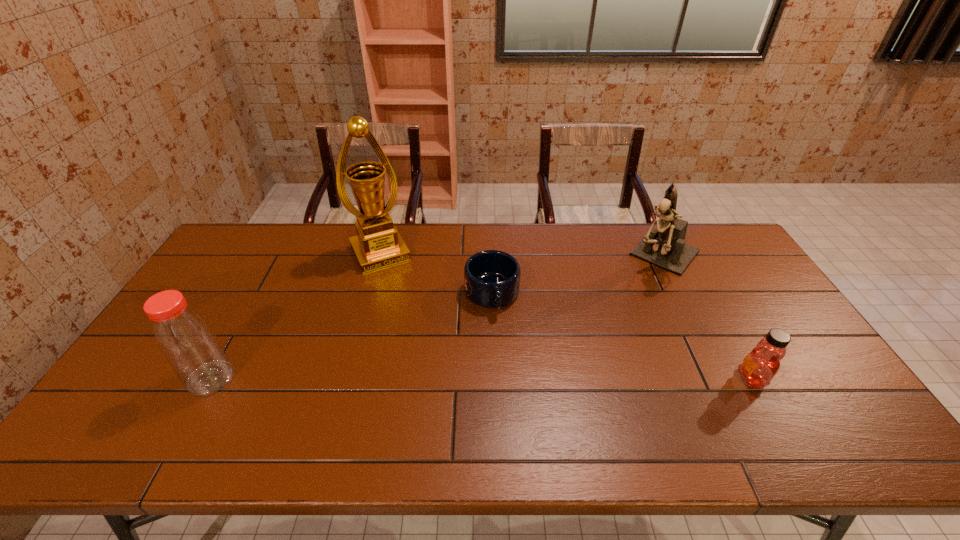
Where is `vacant space located 0.250m with the handle on the side of the shortest object`? The image size is (960, 540). vacant space located 0.250m with the handle on the side of the shortest object is located at coordinates point(513,389).

Locate an element on the screen. award positioned at the far edge is located at coordinates (378, 244).

At what (x,y) coordinates should I click in order to perform the action: click on figurine that is positioned at the far edge. Please return your answer as a coordinate pair (x, y). Looking at the image, I should click on (665, 247).

Where is `bottle at the near edge`? The height and width of the screenshot is (540, 960). bottle at the near edge is located at coordinates (185, 338).

At what (x,y) coordinates should I click in order to perform the action: click on honey positioned at the near edge. Please return your answer as a coordinate pair (x, y). The image size is (960, 540). Looking at the image, I should click on (759, 367).

The height and width of the screenshot is (540, 960). Find the location of `object situated at the left edge`. object situated at the left edge is located at coordinates (185, 338).

Where is `object at the right edge`? This screenshot has height=540, width=960. object at the right edge is located at coordinates (665, 247).

Image resolution: width=960 pixels, height=540 pixels. Identify the location of object located at the near left corner. (185, 338).

At what (x,y) coordinates should I click in order to perform the action: click on object located at the far right corner. Please return your answer as a coordinate pair (x, y). Looking at the image, I should click on (665, 247).

In the image, there is a desktop. Identify the location of free space at the far edge. (429, 248).